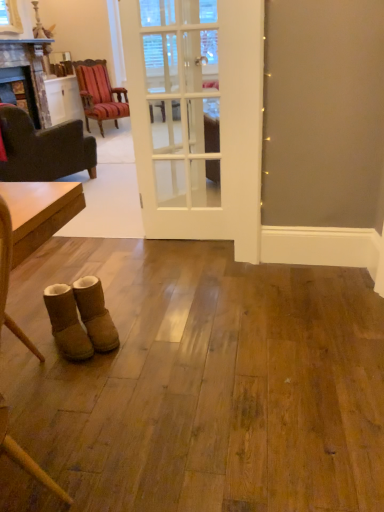
Describe the element at coordinates (197, 117) in the screenshot. The width and height of the screenshot is (384, 512). I see `white glass door at center` at that location.

This screenshot has width=384, height=512. I want to click on dark brown fabric armchair at left, the first chair ordered from the bottom, so click(x=43, y=149).

How much space does striped fabric chair at upper left, which appears as the second chair when viewed from the front, occupy vertically?

It is 39.13 inches.

Describe the element at coordinates (95, 314) in the screenshot. I see `suede boots at lower left, the 1th footwear in the right-to-left sequence` at that location.

Locate an element on the screen. The height and width of the screenshot is (512, 384). white glass door at center is located at coordinates (197, 117).

Can you tell me how much wooden polished table at left and suede boots at lower left, which ranks as the first footwear in left-to-right order, differ in facing direction?

They differ by 38 degrees in their facing directions.

Image resolution: width=384 pixels, height=512 pixels. I want to click on footwear that is the 1st one when counting backward from the wooden polished table at left, so click(x=67, y=323).

Which of these two, wooden polished table at left or suede boots at lower left, acting as the second footwear starting from the right, is thinner?

With smaller width is suede boots at lower left, acting as the second footwear starting from the right.

Which is closer, (x=91, y=153) or (x=180, y=42)?

The point (x=180, y=42) is more forward.

Can you tell me how much dark brown fabric armchair at left, the first chair ordered from the bottom, and white glass door at center differ in facing direction?

There is a 153-degree angle between the facing directions of dark brown fabric armchair at left, the first chair ordered from the bottom, and white glass door at center.

From a real-world perspective, is dark brown fabric armchair at left, which appears as the second chair when viewed from the back, physically located above or below white glass door at center?

From a real-world perspective, dark brown fabric armchair at left, which appears as the second chair when viewed from the back, is physically below white glass door at center.

What are the coordinates of `the 2nd chair to the left when counting from the white glass door at center` in the screenshot? It's located at (43, 149).

From the image's perspective, does striped fabric chair at upper left, positioned as the 1th chair in back-to-front order, appear higher than marble fireplace at left?

Yes, from the image's perspective, striped fabric chair at upper left, positioned as the 1th chair in back-to-front order, is on top of marble fireplace at left.

Does point (92, 83) lie in front of point (42, 50)?

That is False.

Is striped fabric chair at upper left, which appears as the second chair when viewed from the front, positioned before marble fireplace at left?

No, the depth of striped fabric chair at upper left, which appears as the second chair when viewed from the front, is greater than that of marble fireplace at left.

Where is `fireplace positioned vertically above the striped fabric chair at upper left, the 2th chair from the bottom (from a real-world perspective)`? The height and width of the screenshot is (512, 384). fireplace positioned vertically above the striped fabric chair at upper left, the 2th chair from the bottom (from a real-world perspective) is located at coordinates (27, 74).

Does dark brown fabric armchair at left, which appears as the second chair when viewed from the back, come behind suede boots at lower left, the 1th footwear in the right-to-left sequence?

Yes, it is behind suede boots at lower left, the 1th footwear in the right-to-left sequence.

Locate an element on the screen. The width and height of the screenshot is (384, 512). the 1st footwear below when counting from the dark brown fabric armchair at left, which appears as the second chair when viewed from the back (from the image's perspective) is located at coordinates (95, 314).

Between dark brown fabric armchair at left, placed as the second chair when sorted from top to bottom, and suede boots at lower left, the 1th footwear in the right-to-left sequence, which one has less height?

suede boots at lower left, the 1th footwear in the right-to-left sequence.

Considering the sizes of objects dark brown fabric armchair at left, the 1th chair in the front-to-back sequence, and suede boots at lower left, which ranks as the second footwear in left-to-right order, in the image provided, who is bigger, dark brown fabric armchair at left, the 1th chair in the front-to-back sequence, or suede boots at lower left, which ranks as the second footwear in left-to-right order,?

Bigger between the two is dark brown fabric armchair at left, the 1th chair in the front-to-back sequence.

Looking at their sizes, would you say marble fireplace at left is wider or thinner than wooden polished table at left?

Considering their sizes, marble fireplace at left looks broader than wooden polished table at left.

Which is in front, point (50, 42) or point (43, 234)?

Point (43, 234)

Is marble fireplace at left further to the viewer compared to wooden polished table at left?

Yes, it is.

Would you say marble fireplace at left is a long distance from wooden polished table at left?

marble fireplace at left is positioned a significant distance from wooden polished table at left.

Is point (50, 321) closer to camera compared to point (59, 168)?

Yes, it is.

From the dark brown fabric armchair at left, the 1th chair in the front-to-back sequence, count 1st footwear to the right and point to it. Please provide its 2D coordinates.

[(67, 323)]

Which object is positioned more to the right, suede boots at lower left, acting as the second footwear starting from the right, or dark brown fabric armchair at left, the first chair ordered from the bottom?

Positioned to the right is suede boots at lower left, acting as the second footwear starting from the right.

Would you say suede boots at lower left, which ranks as the first footwear in left-to-right order, is outside dark brown fabric armchair at left, which appears as the second chair when viewed from the back?

suede boots at lower left, which ranks as the first footwear in left-to-right order, lies outside dark brown fabric armchair at left, which appears as the second chair when viewed from the back,'s area.

Is striped fabric chair at upper left, marked as the first chair in a top-to-bottom arrangement, positioned with its back to white glass door at center?

striped fabric chair at upper left, marked as the first chair in a top-to-bottom arrangement, does not have its back to white glass door at center.

From the image's perspective, is striped fabric chair at upper left, the 2th chair from the bottom, located above or below white glass door at center?

Clearly, from the image's perspective, striped fabric chair at upper left, the 2th chair from the bottom, is above white glass door at center.

Is striped fabric chair at upper left, positioned as the 1th chair in back-to-front order, bigger or smaller than white glass door at center?

In the image, striped fabric chair at upper left, positioned as the 1th chair in back-to-front order, appears to be larger than white glass door at center.

This screenshot has width=384, height=512. What are the coordinates of `the 1st footwear counting from the right of the wooden polished table at left` in the screenshot? It's located at (67, 323).

The width and height of the screenshot is (384, 512). Identify the location of the 2nd chair to the left of the white glass door at center, counting from the anchor's position. (43, 149).

In the scene shown: Which object lies nearer to the anchor point wooden polished table at left, dark brown fabric armchair at left, placed as the second chair when sorted from top to bottom, or marble fireplace at left?

dark brown fabric armchair at left, placed as the second chair when sorted from top to bottom, is closer to wooden polished table at left.

Which object lies further to the anchor point suede boots at lower left, which ranks as the second footwear in left-to-right order, suede boots at lower left, acting as the second footwear starting from the right, or white glass door at center?

The object further to suede boots at lower left, which ranks as the second footwear in left-to-right order, is white glass door at center.

From the image, which object appears to be nearer to wooden polished table at left, striped fabric chair at upper left, marked as the first chair in a top-to-bottom arrangement, or dark brown fabric armchair at left, the first chair ordered from the bottom?

Among the two, dark brown fabric armchair at left, the first chair ordered from the bottom, is located nearer to wooden polished table at left.

Based on their spatial positions, is marble fireplace at left or striped fabric chair at upper left, the 2th chair from the bottom, closer to white glass door at center?

Based on the image, marble fireplace at left appears to be nearer to white glass door at center.

Estimate the real-world distances between objects in this image. Which object is further from dark brown fabric armchair at left, the first chair ordered from the bottom, white glass door at center or suede boots at lower left, which ranks as the second footwear in left-to-right order?

The object further to dark brown fabric armchair at left, the first chair ordered from the bottom, is suede boots at lower left, which ranks as the second footwear in left-to-right order.

Estimate the real-world distances between objects in this image. Which object is closer to dark brown fabric armchair at left, the 1th chair in the front-to-back sequence, striped fabric chair at upper left, positioned as the 1th chair in back-to-front order, or white glass door at center?

The object closer to dark brown fabric armchair at left, the 1th chair in the front-to-back sequence, is white glass door at center.

From the image, which object appears to be farther from striped fabric chair at upper left, the 2th chair from the bottom, dark brown fabric armchair at left, the 1th chair in the front-to-back sequence, or marble fireplace at left?

dark brown fabric armchair at left, the 1th chair in the front-to-back sequence, is further to striped fabric chair at upper left, the 2th chair from the bottom.

Based on their spatial positions, is dark brown fabric armchair at left, which appears as the second chair when viewed from the back, or marble fireplace at left further from white glass door at center?

Based on the image, marble fireplace at left appears to be further to white glass door at center.

The image size is (384, 512). I want to click on door positioned between wooden polished table at left and dark brown fabric armchair at left, the first chair ordered from the bottom, from near to far, so click(x=197, y=117).

Identify the location of chair between suede boots at lower left, the 1th footwear in the right-to-left sequence, and striped fabric chair at upper left, which appears as the second chair when viewed from the front, in the front-back direction. The height and width of the screenshot is (512, 384). (43, 149).

Identify the location of footwear positioned between suede boots at lower left, acting as the second footwear starting from the right, and marble fireplace at left from near to far. The height and width of the screenshot is (512, 384). (95, 314).

Where is `door between suede boots at lower left, acting as the second footwear starting from the right, and dark brown fabric armchair at left, the first chair ordered from the bottom, along the z-axis`? This screenshot has width=384, height=512. door between suede boots at lower left, acting as the second footwear starting from the right, and dark brown fabric armchair at left, the first chair ordered from the bottom, along the z-axis is located at coordinates (197, 117).